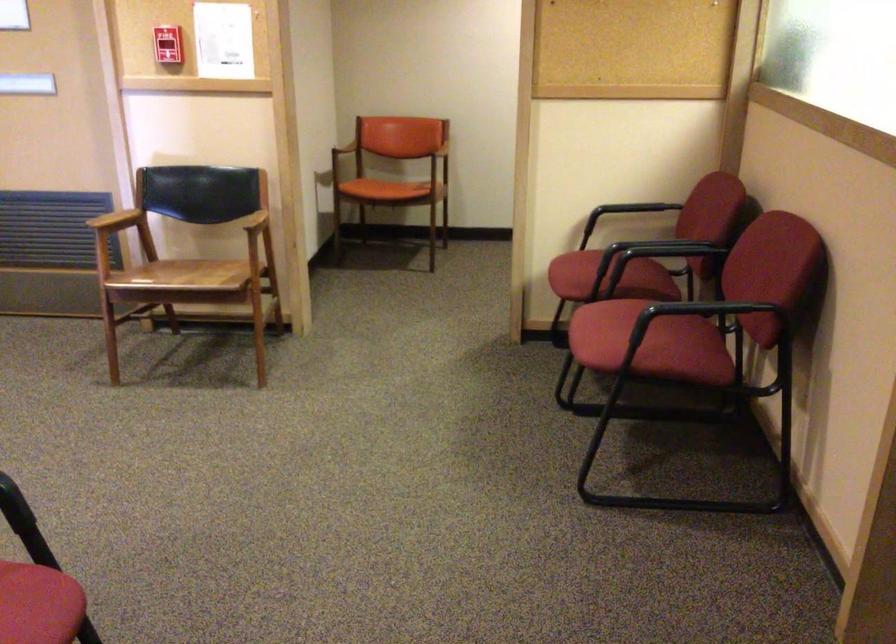
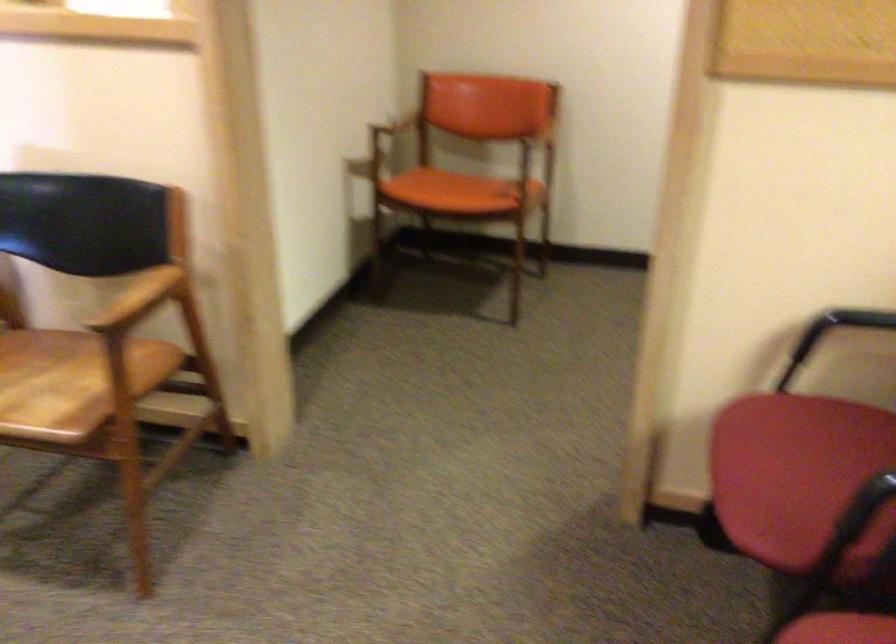
The point at [205,274] is marked in the first image. Where is the corresponding point in the second image?

(71, 381)